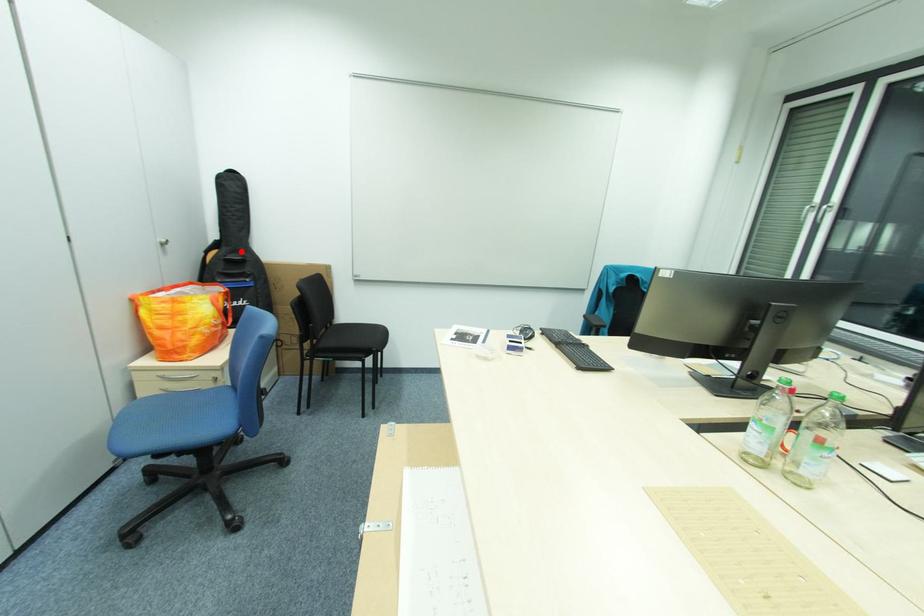
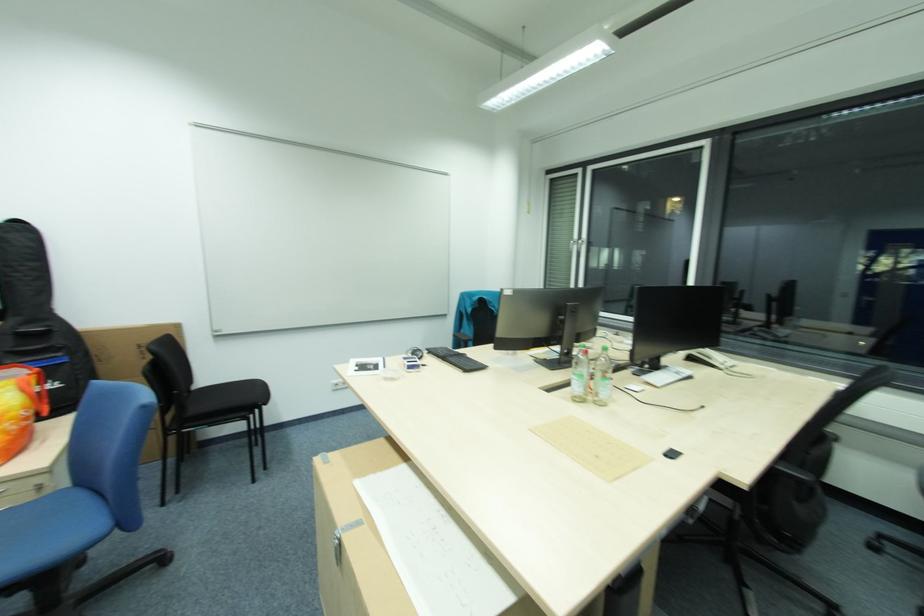
Question: I am providing you with two images of the same scene from different viewpoints. Given a red point in image1, look at the same physical point in image2. Is it:

Choices:
 (A) Closer to the viewpoint
 (B) Farther from the viewpoint

Answer: (B)